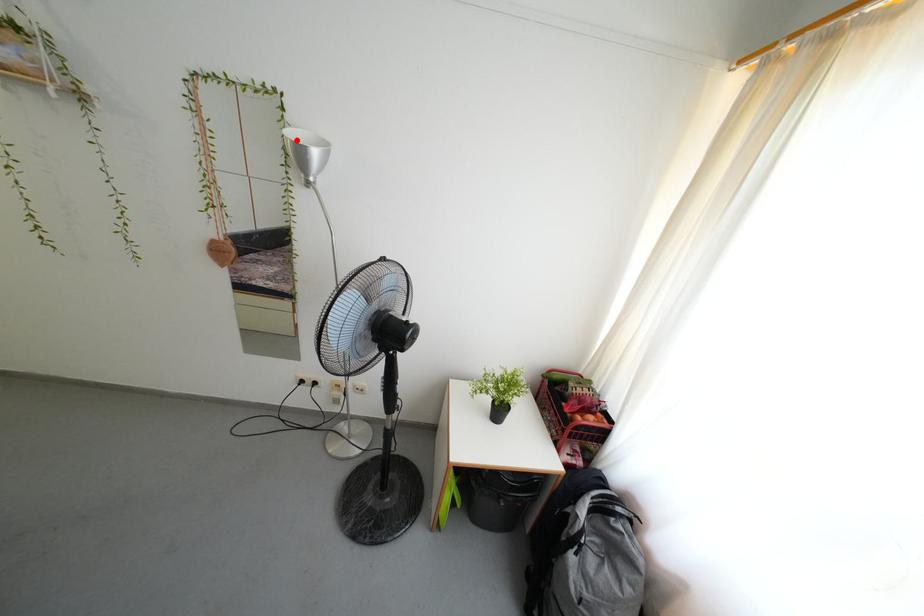
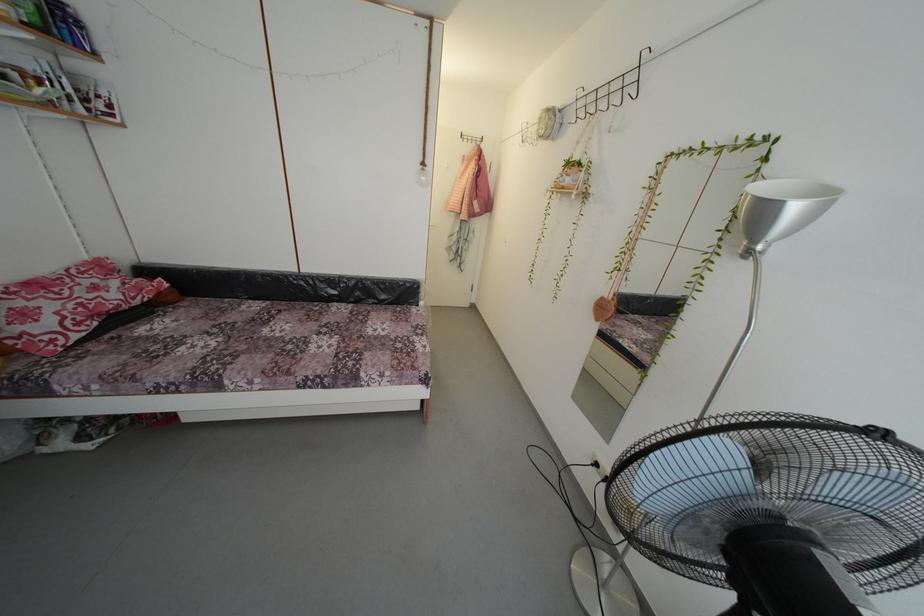
The point at the highlighted location is marked in the first image. Where is the corresponding point in the second image?

(766, 195)